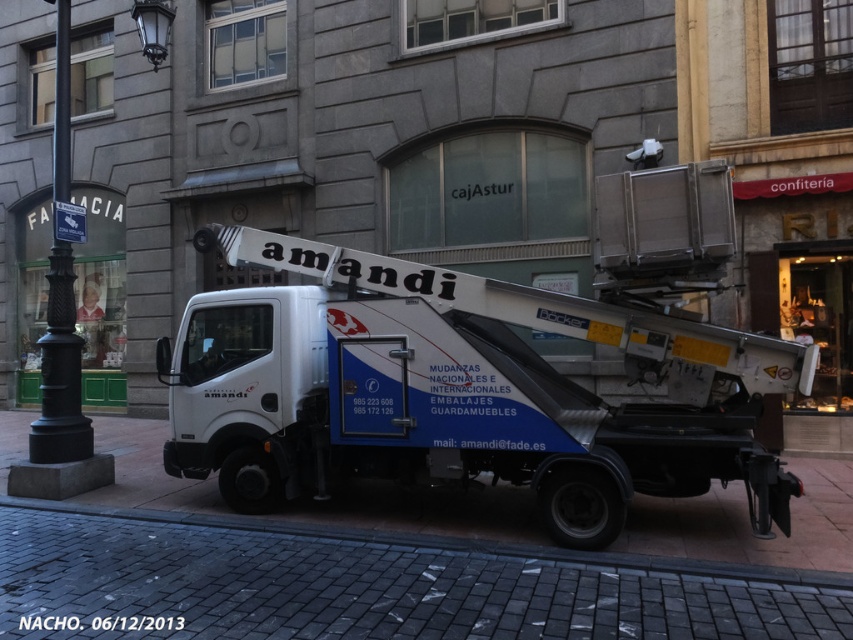
Does gray cobblestone pavement at center have a lesser width compared to black cast iron pole at left?

In fact, gray cobblestone pavement at center might be wider than black cast iron pole at left.

Does gray cobblestone pavement at center appear under black cast iron pole at left?

Correct, gray cobblestone pavement at center is located below black cast iron pole at left.

Identify the location of gray cobblestone pavement at center. (372, 584).

Between white metallic truck at center and black metal lamp post at left, which one has less height?

Standing shorter between the two is black metal lamp post at left.

Between point (416, 360) and point (73, 403), which one is positioned in front?

Point (416, 360)

This screenshot has height=640, width=853. I want to click on white metallic truck at center, so click(x=457, y=390).

Which is more to the left, white metallic truck at center or black cast iron pole at left?

black cast iron pole at left

Is white metallic truck at center shorter than black cast iron pole at left?

No, white metallic truck at center is not shorter than black cast iron pole at left.

Measure the distance between white metallic truck at center and camera.

white metallic truck at center is 19.32 feet from camera.

Where is `white metallic truck at center`? white metallic truck at center is located at coordinates (457, 390).